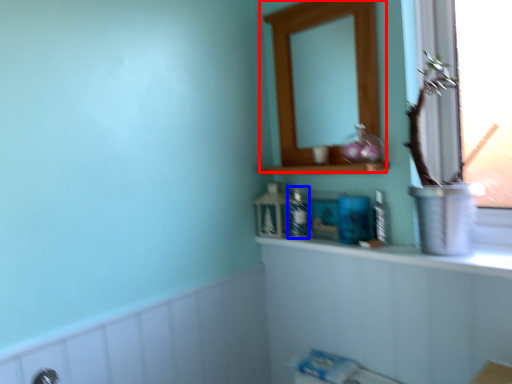
Question: Which object is further to the camera taking this photo, medicine cabinet (highlighted by a red box) or toiletry (highlighted by a blue box)?

Choices:
 (A) medicine cabinet
 (B) toiletry

Answer: (B)